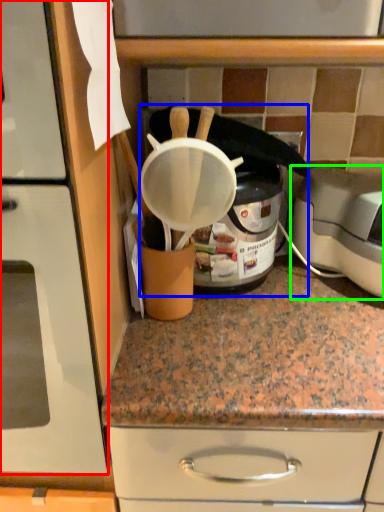
Question: Estimate the real-world distances between objects in this image. Which object is farther from home appliance (highlighted by a red box), appliance (highlighted by a blue box) or toaster (highlighted by a green box)?

Choices:
 (A) appliance
 (B) toaster

Answer: (B)